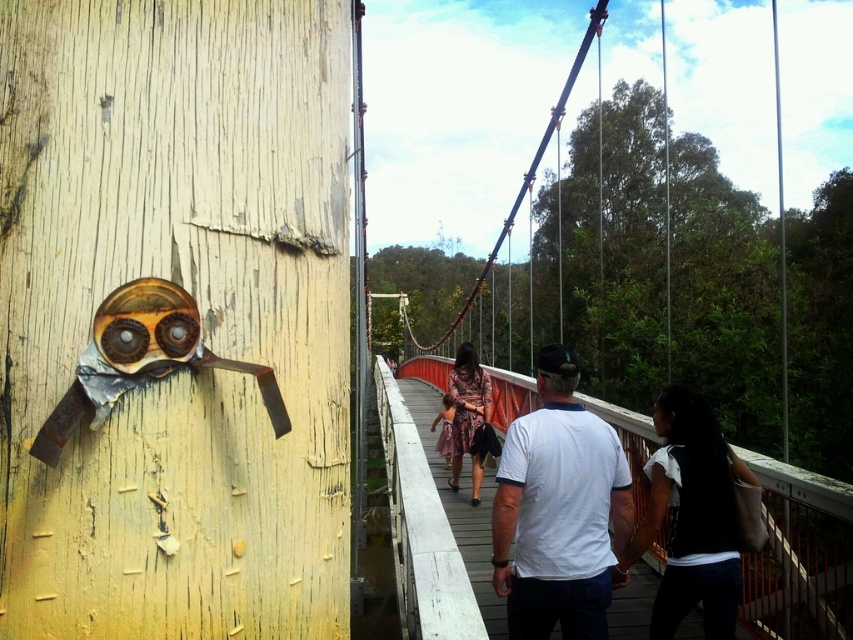
Question: Can you confirm if white cotton shirt at center is positioned to the right of floral dress at center?

Choices:
 (A) yes
 (B) no

Answer: (A)

Question: Can you confirm if white cotton shirt at center is wider than floral dress at center?

Choices:
 (A) no
 (B) yes

Answer: (B)

Question: Can you confirm if white cotton shirt at center is wider than floral dress at center?

Choices:
 (A) yes
 (B) no

Answer: (A)

Question: Which point is farther to the camera?

Choices:
 (A) (598, 592)
 (B) (480, 372)

Answer: (B)

Question: Which of the following is the closest to the observer?

Choices:
 (A) (612, 502)
 (B) (465, 353)

Answer: (A)